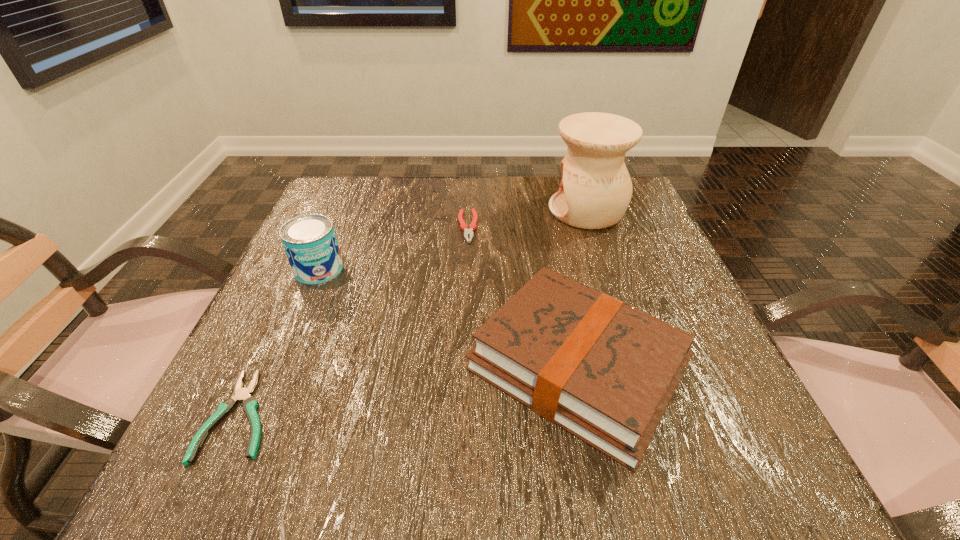
At what (x,y) coordinates should I click in order to perform the action: click on vacant space at the far left corner of the desktop. Please return your answer as a coordinate pair (x, y). Looking at the image, I should click on (342, 191).

The width and height of the screenshot is (960, 540). In order to click on vacant area at the near left corner of the desktop in this screenshot , I will do `click(239, 478)`.

This screenshot has height=540, width=960. I want to click on vacant space at the far right corner of the desktop, so click(632, 208).

This screenshot has height=540, width=960. In order to click on free space at the near right corner of the desktop in this screenshot , I will do click(x=724, y=477).

You are a GUI agent. You are given a task and a screenshot of the screen. Output one action in this format:
    pyautogui.click(x=<x>, y=<y>)
    Task: Click on the empty location between the tallest object and the third nearest object
    The image size is (960, 540).
    Given the screenshot: What is the action you would take?
    pyautogui.click(x=453, y=240)

This screenshot has width=960, height=540. Find the location of `vacant space in between the right pliers and the tallest object`. vacant space in between the right pliers and the tallest object is located at coordinates (527, 219).

At what (x,y) coordinates should I click in order to perform the action: click on empty space between the shorter pliers and the third nearest object. Please return your answer as a coordinate pair (x, y). This screenshot has height=540, width=960. Looking at the image, I should click on (280, 342).

The height and width of the screenshot is (540, 960). Find the location of `vacant region between the right pliers and the fourth shortest object`. vacant region between the right pliers and the fourth shortest object is located at coordinates (394, 248).

Identify the location of vacant area between the tallest object and the third farthest object. Image resolution: width=960 pixels, height=540 pixels. (453, 240).

At what (x,y) coordinates should I click in order to perform the action: click on free space between the shorter pliers and the tallest object. Please return your answer as a coordinate pair (x, y). This screenshot has width=960, height=540. Looking at the image, I should click on (414, 313).